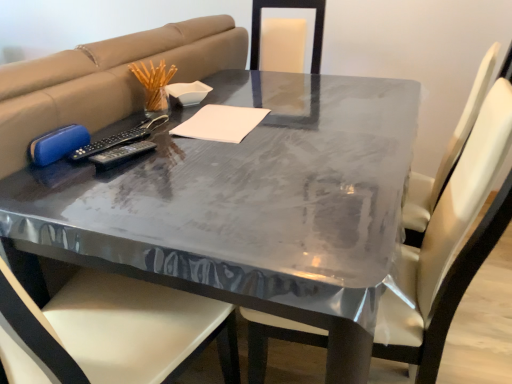
I want to click on free space on the front side of white paper at center, so click(x=227, y=156).